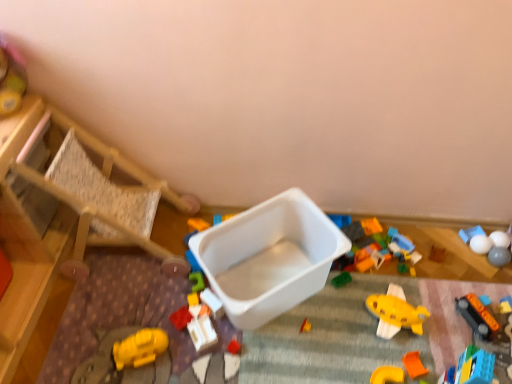
Locate an element on the screen. This screenshot has width=512, height=384. vacant area that lies between orange matte plastic toy at lower right, the 10th toy viewed from the right, and orange plastic train at lower right, the tenth toy in the left-to-right sequence is located at coordinates (429, 347).